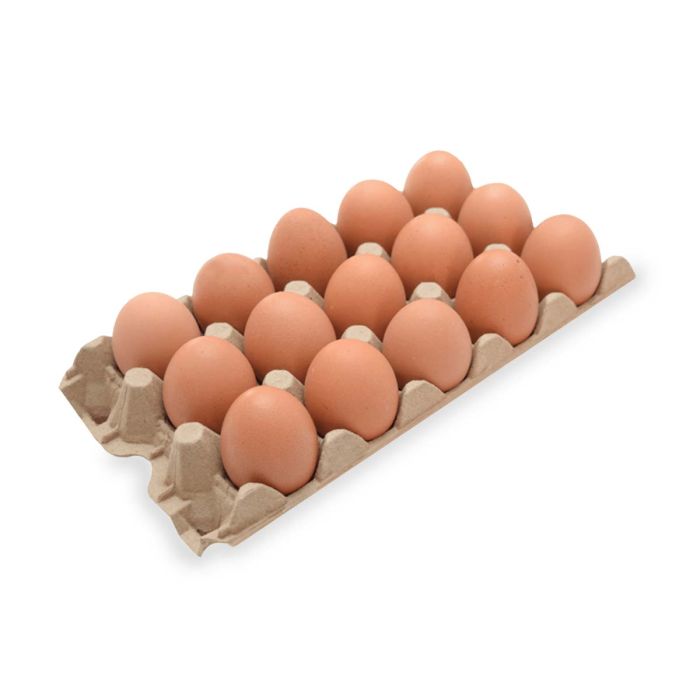
Identify the location of cardboard dividers. [x=138, y=368], [x=214, y=322], [x=301, y=276], [x=368, y=243], [x=440, y=206], [x=496, y=243], [x=428, y=281], [x=356, y=330], [x=276, y=372], [x=190, y=435].